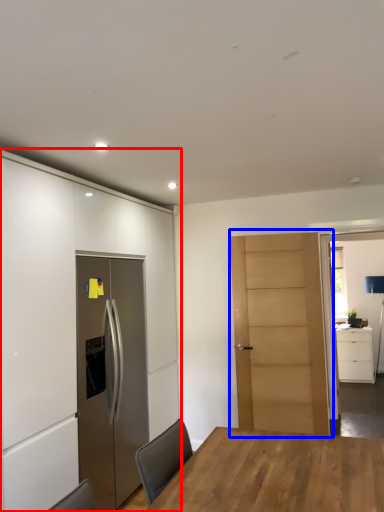
Question: Which object appears closest to the camera in this image, cabinetry (highlighted by a red box) or door (highlighted by a blue box)?

Choices:
 (A) cabinetry
 (B) door

Answer: (A)